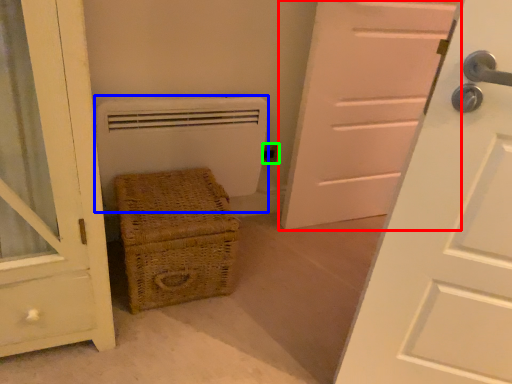
Question: Which object is the farthest from door (highlighted by a red box)? Choose among these: heater (highlighted by a blue box) or electric outlet (highlighted by a green box).

Choices:
 (A) heater
 (B) electric outlet

Answer: (A)